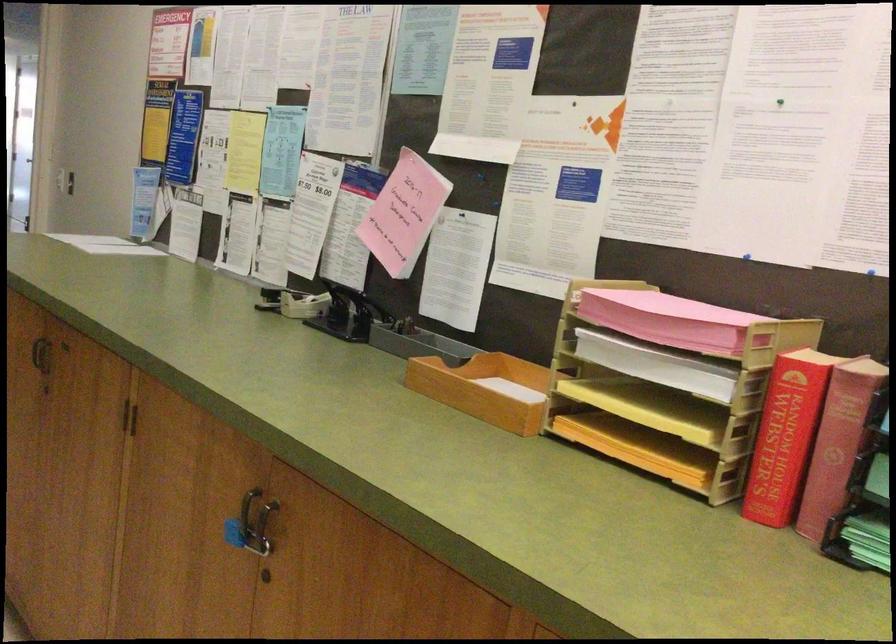
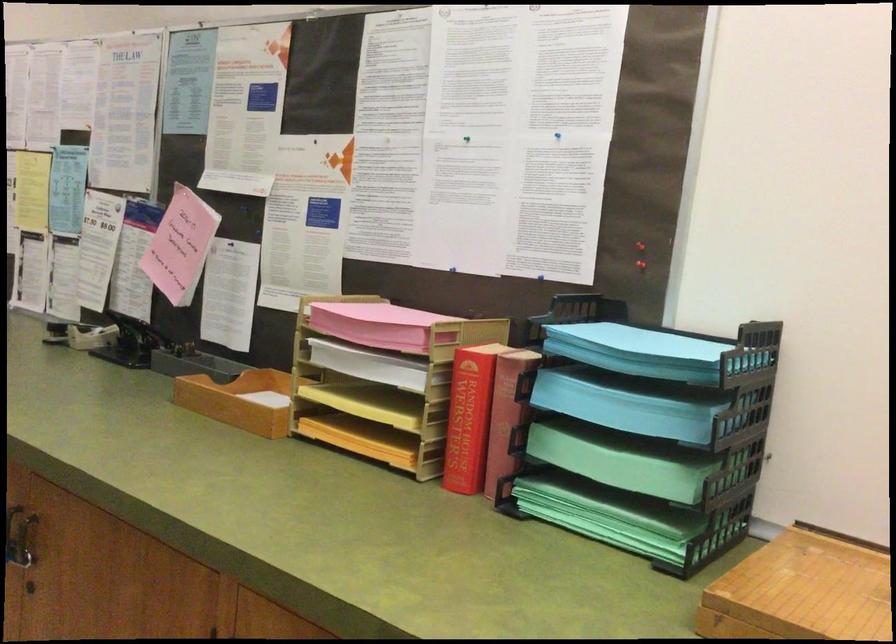
Looking at this image, which direction would the cameraman need to move to produce the second image?

The cameraman moved toward right, backward.